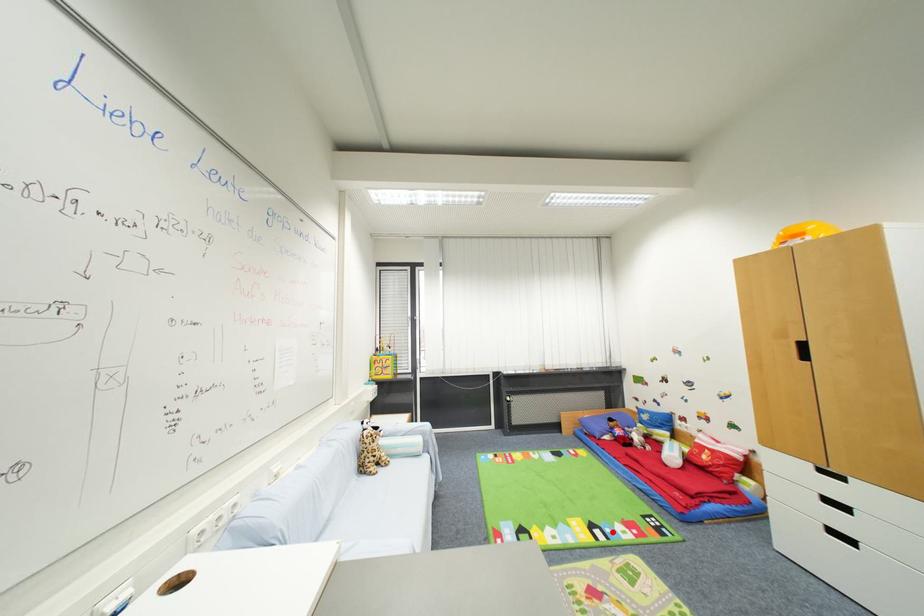
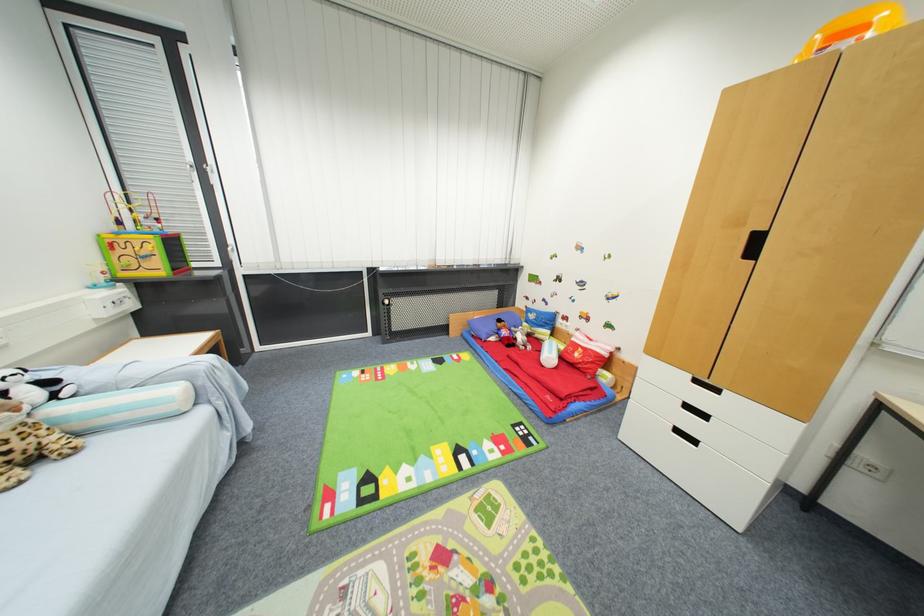
Where in the second image is the point corresponding to the highlighted location from the first image?

(479, 455)